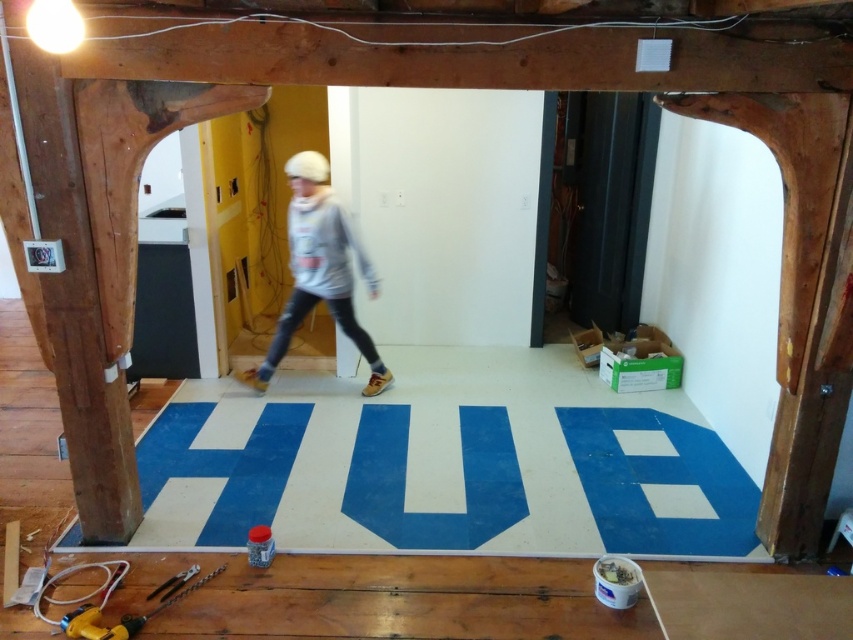
Does gray fleece sweatshirt at center appear over metallic silver pliers at lower left?

Yes.

Does point (389, 372) lie behind point (152, 596)?

Yes, it is behind point (152, 596).

You are a GUI agent. You are given a task and a screenshot of the screen. Output one action in this format:
    pyautogui.click(x=<x>, y=<y>)
    Task: Click on the gray fleece sweatshirt at center
    This screenshot has width=853, height=640.
    Given the screenshot: What is the action you would take?
    pyautogui.click(x=320, y=269)